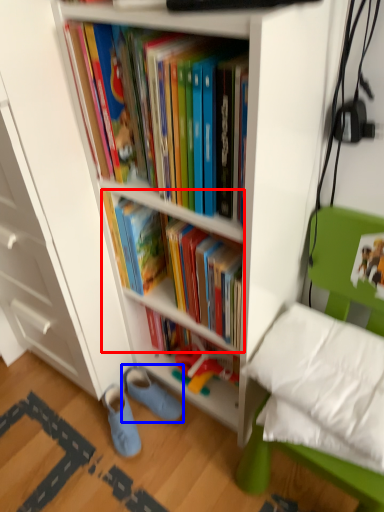
Question: Which point is further to the camera, book (highlighted by a red box) or footwear (highlighted by a blue box)?

Choices:
 (A) book
 (B) footwear

Answer: (B)